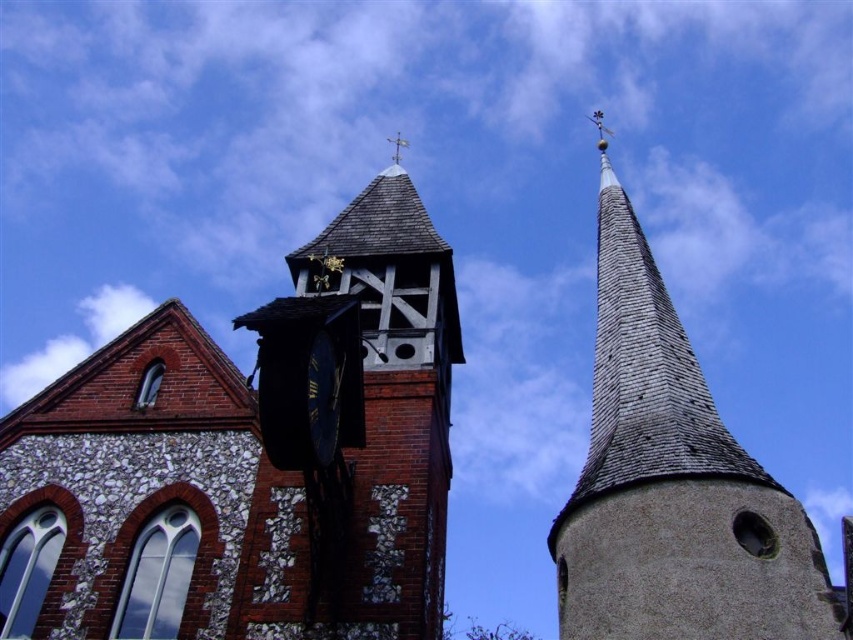
Which is in front, point (193, 561) or point (589, 458)?

Point (193, 561) is more forward.

Can you confirm if brick clock tower at center is wider than gray stone steeple at upper right?

In fact, brick clock tower at center might be narrower than gray stone steeple at upper right.

Is point (317, 625) farther from viewer compared to point (613, 522)?

No, (317, 625) is closer to viewer.

In order to click on brick clock tower at center in this screenshot , I will do `click(248, 460)`.

Can you confirm if brick clock tower at center is positioned to the right of blue metallic clock at center?

Incorrect, brick clock tower at center is not on the right side of blue metallic clock at center.

Find the location of a particular element. brick clock tower at center is located at coordinates (248, 460).

Between gray stone steeple at upper right and blue metallic clock at center, which one has more height?

With more height is gray stone steeple at upper right.

Is point (758, 532) positioned before point (317, 346)?

No, it is behind (317, 346).

Is point (708, 525) farther from camera compared to point (320, 348)?

That is True.

The width and height of the screenshot is (853, 640). In order to click on gray stone steeple at upper right in this screenshot , I will do `click(672, 483)`.